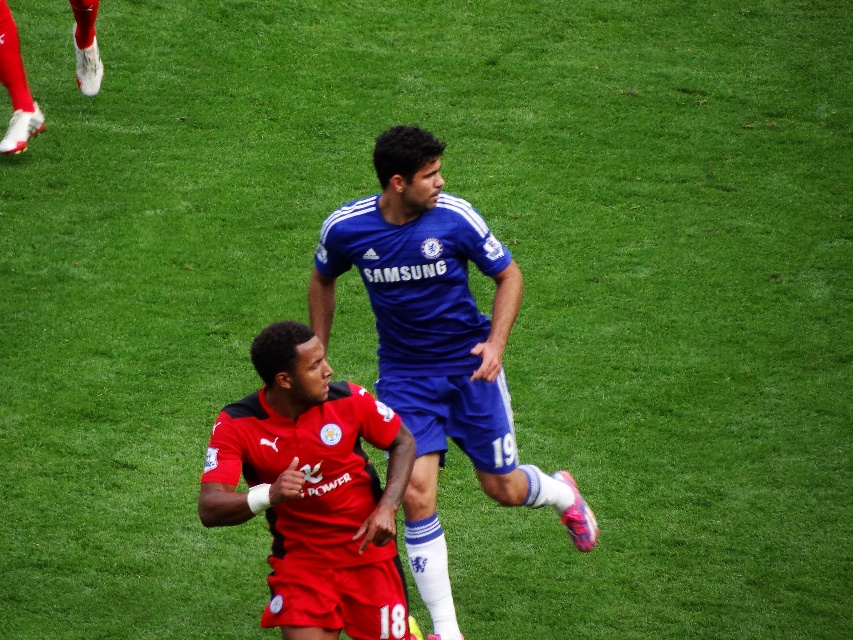
Question: Which object appears farthest from the camera in this image?

Choices:
 (A) blue fabric soccer player at center
 (B) red jersey at center
 (C) blue jersey at center

Answer: (C)

Question: Does blue fabric soccer player at center have a smaller size compared to red jersey at center?

Choices:
 (A) no
 (B) yes

Answer: (A)

Question: Is blue fabric soccer player at center further to the viewer compared to red jersey at center?

Choices:
 (A) no
 (B) yes

Answer: (B)

Question: Does blue fabric soccer player at center have a larger size compared to red jersey at center?

Choices:
 (A) no
 (B) yes

Answer: (B)

Question: Which object is closer to the camera taking this photo?

Choices:
 (A) red jersey at center
 (B) blue jersey at center
 (C) blue fabric soccer player at center

Answer: (A)

Question: Estimate the real-world distances between objects in this image. Which object is farther from the blue jersey at center?

Choices:
 (A) blue fabric soccer player at center
 (B) red jersey at center

Answer: (B)